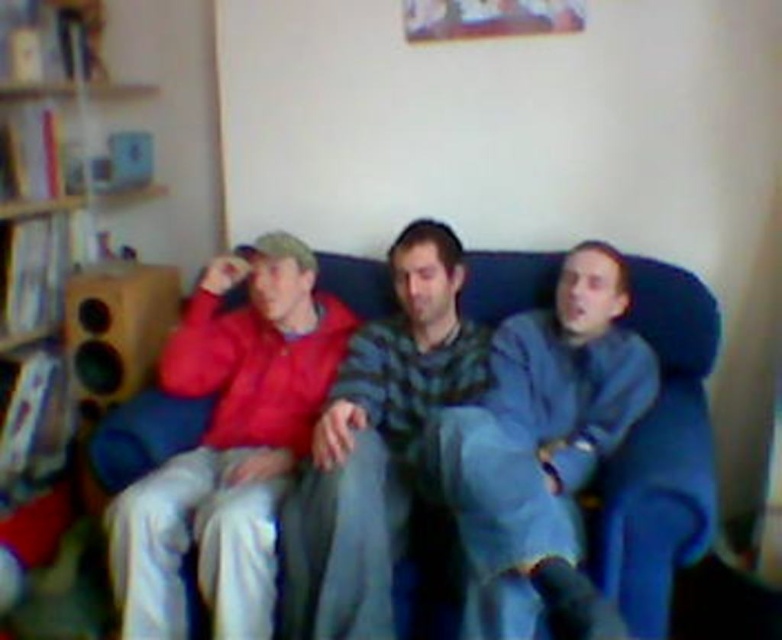
You are trying to find the blue fuzzy blanket at center in the living room. According to the coordinates provided, where exactly would you look?

The blue fuzzy blanket at center is located at point coordinates of [540,436].